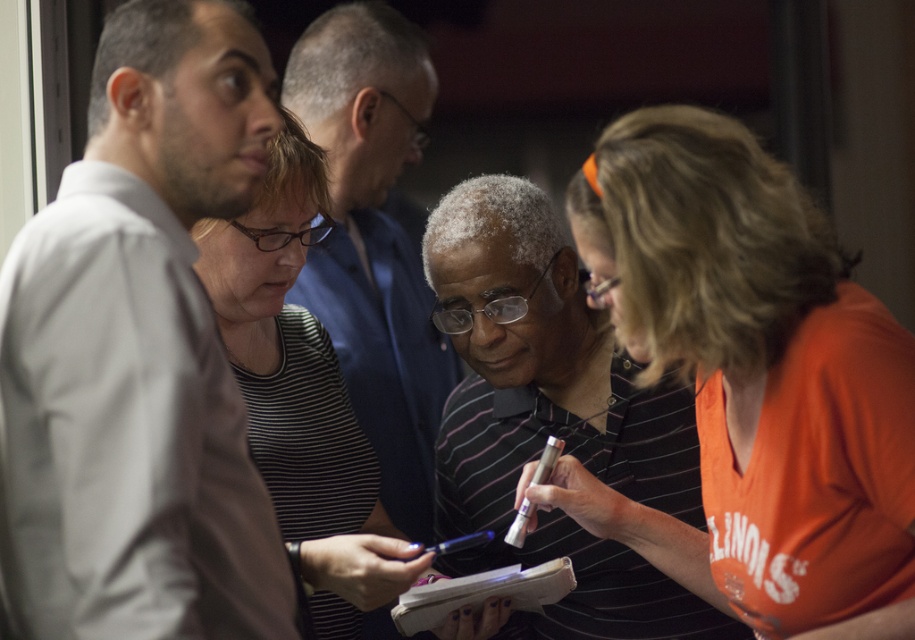
Between orange jersey at center and striped polo shirt at center, which one has more height?

striped polo shirt at center

Who is more distant from viewer, (591, 188) or (518, 339)?

Positioned behind is point (518, 339).

This screenshot has height=640, width=915. What do you see at coordinates (766, 372) in the screenshot?
I see `orange jersey at center` at bounding box center [766, 372].

You are a GUI agent. You are given a task and a screenshot of the screen. Output one action in this format:
    pyautogui.click(x=<x>, y=<y>)
    Task: Click on the orange jersey at center
    Image resolution: width=915 pixels, height=640 pixels.
    Given the screenshot: What is the action you would take?
    pyautogui.click(x=766, y=372)

Between blue shirt at center and striped fabric shirt at center, which one has more height?

Standing taller between the two is blue shirt at center.

Which is more to the left, blue shirt at center or striped fabric shirt at center?

From the viewer's perspective, striped fabric shirt at center appears more on the left side.

Find the location of `blue shirt at center`. blue shirt at center is located at coordinates (374, 241).

This screenshot has width=915, height=640. Identify the location of blue shirt at center. (374, 241).

Which is above, gray shirt at left or blue shirt at center?

blue shirt at center is higher up.

Is point (268, 573) closer to viewer compared to point (323, 273)?

Yes.

The image size is (915, 640). I want to click on gray shirt at left, so click(x=138, y=353).